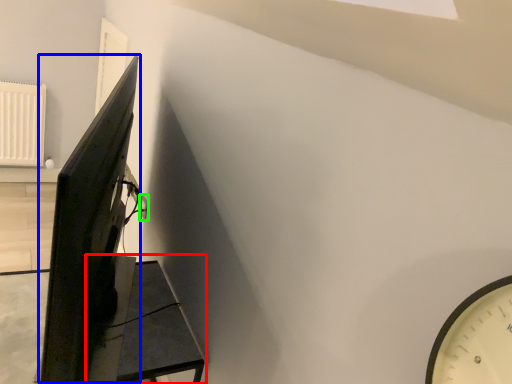
Question: Estimate the real-world distances between objects in this image. Which object is closer to furniture (highlighted by a red box), computer monitor (highlighted by a blue box) or electric outlet (highlighted by a green box)?

Choices:
 (A) computer monitor
 (B) electric outlet

Answer: (A)